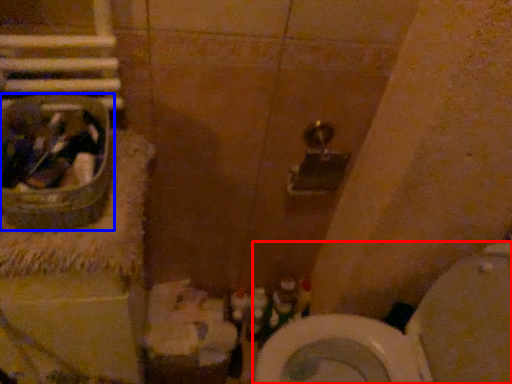
Question: Which point is further to the camera, toilet (highlighted by a red box) or sink (highlighted by a blue box)?

Choices:
 (A) toilet
 (B) sink

Answer: (A)